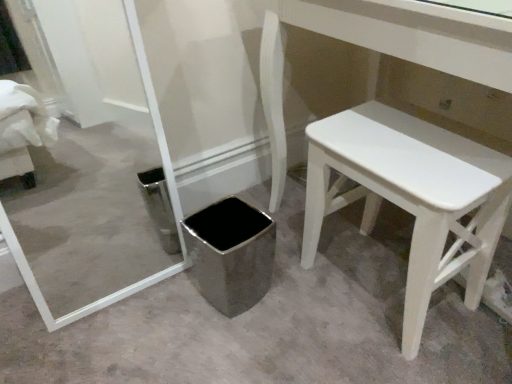
Question: Considering their positions, is white painted wood stool at lower right located in front of or behind polished stainless steel trash can at center?

Choices:
 (A) front
 (B) behind

Answer: (A)

Question: Based on their positions, is white painted wood stool at lower right located to the left or right of polished stainless steel trash can at center?

Choices:
 (A) right
 (B) left

Answer: (A)

Question: Is white painted wood stool at lower right spatially inside polished stainless steel trash can at center, or outside of it?

Choices:
 (A) outside
 (B) inside

Answer: (A)

Question: From the image's perspective, is polished stainless steel trash can at center located above or below white painted wood stool at lower right?

Choices:
 (A) below
 (B) above

Answer: (A)

Question: Considering the positions of polished stainless steel trash can at center and white painted wood stool at lower right in the image, is polished stainless steel trash can at center bigger or smaller than white painted wood stool at lower right?

Choices:
 (A) small
 (B) big

Answer: (A)

Question: In terms of height, does polished stainless steel trash can at center look taller or shorter compared to white painted wood stool at lower right?

Choices:
 (A) short
 (B) tall

Answer: (A)

Question: Would you say polished stainless steel trash can at center is to the left or to the right of white painted wood stool at lower right in the picture?

Choices:
 (A) right
 (B) left

Answer: (B)